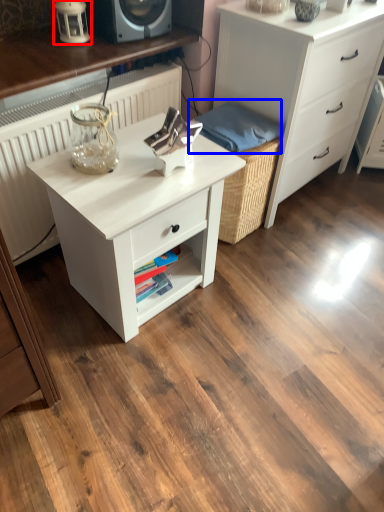
Question: Which of the following is the farthest to the observer, table lamp (highlighted by a red box) or material (highlighted by a blue box)?

Choices:
 (A) table lamp
 (B) material

Answer: (B)